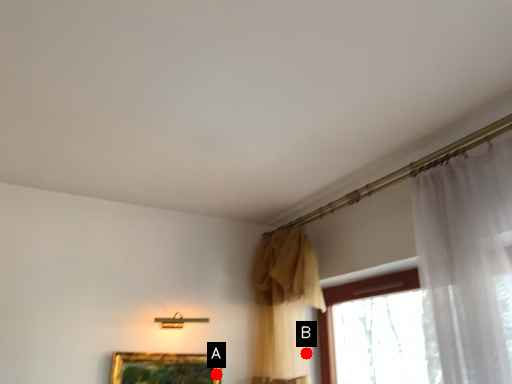
Question: Two points are circled on the image, labeled by A and B beside each circle. Which of the following is the closest to the observer?

Choices:
 (A) A is closer
 (B) B is closer

Answer: (B)